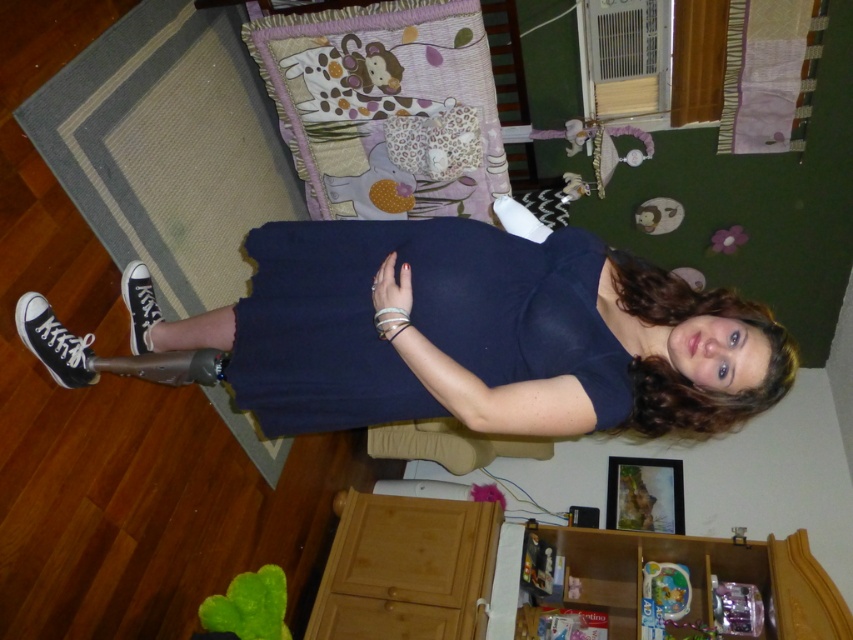
Can you confirm if wooden cabinet at lower center is positioned to the right of wooden drawer at lower center?

Correct, you'll find wooden cabinet at lower center to the right of wooden drawer at lower center.

Who is more forward, (671,536) or (442,516)?

Point (671,536) is more forward.

The width and height of the screenshot is (853, 640). I want to click on wooden cabinet at lower center, so [405, 568].

Identify the location of pastel patchwork pillow at upper center. (386, 108).

Can you confirm if pastel patchwork pillow at upper center is positioned to the left of wooden drawer at lower center?

Correct, you'll find pastel patchwork pillow at upper center to the left of wooden drawer at lower center.

Where is `pastel patchwork pillow at upper center`? The image size is (853, 640). pastel patchwork pillow at upper center is located at coordinates (386, 108).

You are a GUI agent. You are given a task and a screenshot of the screen. Output one action in this format:
    pyautogui.click(x=<x>, y=<y>)
    Task: Click on the pastel patchwork pillow at upper center
    The image size is (853, 640).
    Given the screenshot: What is the action you would take?
    pyautogui.click(x=386, y=108)

Can you confirm if navy blue dress at center is bigger than pastel patchwork pillow at upper center?

Indeed, navy blue dress at center has a larger size compared to pastel patchwork pillow at upper center.

Is point (312, 260) farther from viewer compared to point (469, 65)?

No.

The image size is (853, 640). Find the location of `navy blue dress at center`. navy blue dress at center is located at coordinates (476, 333).